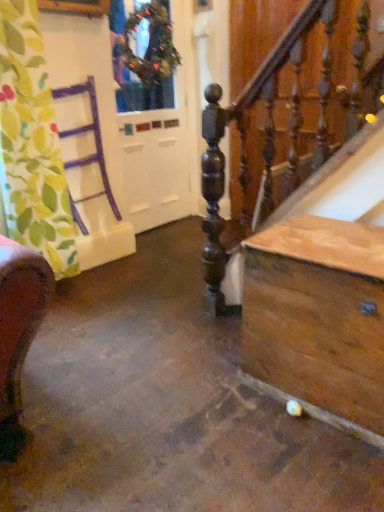
Question: Is green leafy fabric at left far from wooden chest at lower right?

Choices:
 (A) no
 (B) yes

Answer: (B)

Question: Can you confirm if green leafy fabric at left is taller than wooden chest at lower right?

Choices:
 (A) yes
 (B) no

Answer: (A)

Question: Is green leafy fabric at left positioned in front of wooden chest at lower right?

Choices:
 (A) yes
 (B) no

Answer: (B)

Question: Can you confirm if green leafy fabric at left is shorter than wooden chest at lower right?

Choices:
 (A) no
 (B) yes

Answer: (A)

Question: Is green leafy fabric at left facing towards wooden chest at lower right?

Choices:
 (A) yes
 (B) no

Answer: (B)

Question: Can wooden chest at lower right be found inside green leafy fabric at left?

Choices:
 (A) yes
 (B) no

Answer: (B)

Question: Does wooden chest at lower right have a greater width compared to green textured wreath at upper center?

Choices:
 (A) no
 (B) yes

Answer: (B)

Question: Is wooden chest at lower right at the left side of green textured wreath at upper center?

Choices:
 (A) yes
 (B) no

Answer: (B)

Question: From the image's perspective, is wooden chest at lower right located beneath green textured wreath at upper center?

Choices:
 (A) no
 (B) yes

Answer: (B)

Question: Is wooden chest at lower right beside green textured wreath at upper center?

Choices:
 (A) no
 (B) yes

Answer: (A)

Question: Is wooden chest at lower right not within green textured wreath at upper center?

Choices:
 (A) yes
 (B) no

Answer: (A)

Question: Could you tell me if wooden chest at lower right is turned towards green textured wreath at upper center?

Choices:
 (A) no
 (B) yes

Answer: (A)

Question: Does white glossy door at upper left have a lesser height compared to green textured wreath at upper center?

Choices:
 (A) yes
 (B) no

Answer: (B)